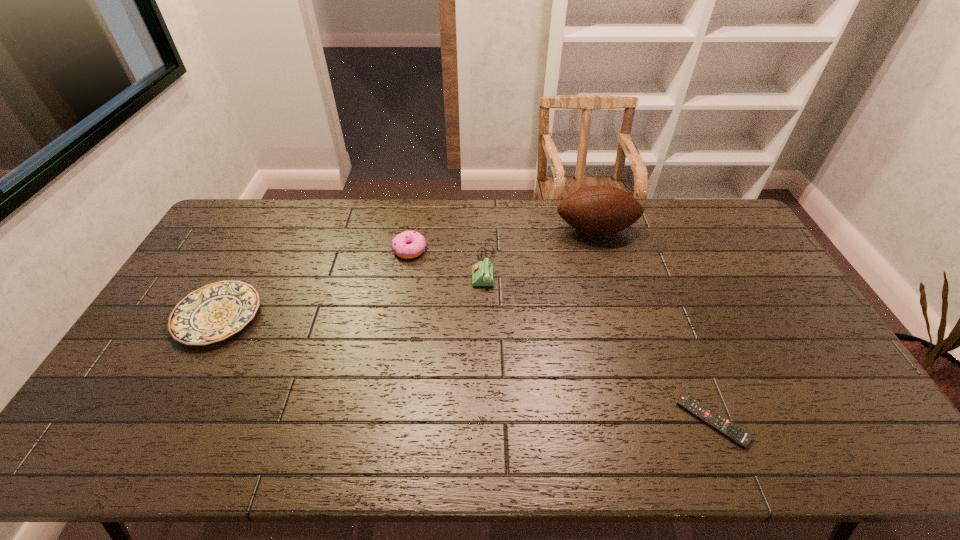
The width and height of the screenshot is (960, 540). Find the location of `the tallest object`. the tallest object is located at coordinates (600, 210).

Locate an element on the screen. This screenshot has height=540, width=960. the third object from right to left is located at coordinates (482, 272).

This screenshot has width=960, height=540. I want to click on the second object from left to right, so click(x=409, y=244).

The image size is (960, 540). I want to click on the leftmost object, so click(212, 313).

Locate an element on the screen. the fourth tallest object is located at coordinates (212, 313).

Where is `the nearest object`? The image size is (960, 540). the nearest object is located at coordinates (724, 426).

Locate an element on the screen. Image resolution: width=960 pixels, height=540 pixels. remote control is located at coordinates (724, 426).

The width and height of the screenshot is (960, 540). I want to click on vacant region located 0.180m on the laces of the football, so click(612, 282).

In order to click on vacant space located 0.330m on the dial of the third object from left to right in this screenshot , I will do `click(373, 268)`.

Locate an element on the screen. vacant region located 0.290m on the dial of the third object from left to right is located at coordinates (385, 268).